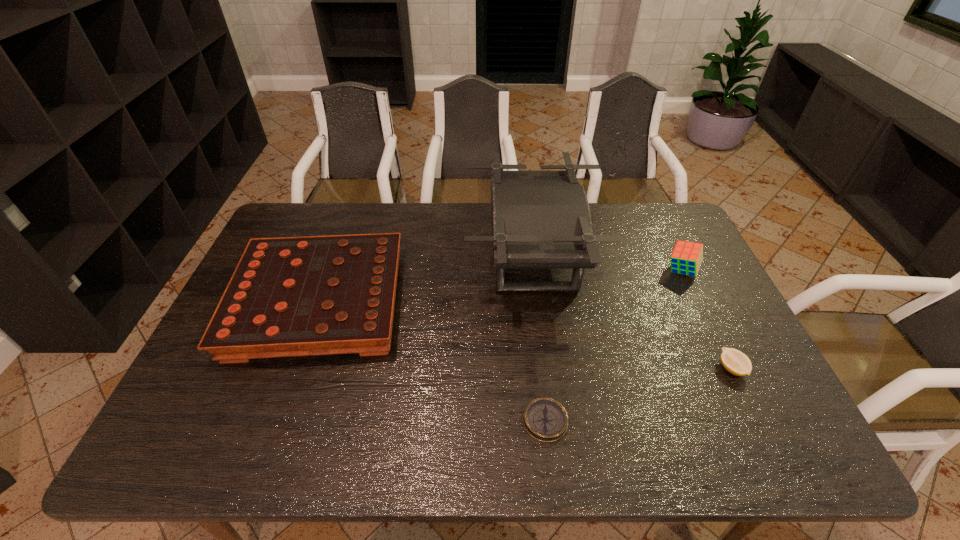
At what (x,y) coordinates should I click in order to perform the action: click on blank space that satisfies the following two spatial constraints: 1. with a camera mounted on the underside of the drone; 2. on the front side of the leftmost object. Please return your answer as a coordinate pair (x, y). Looking at the image, I should click on (539, 303).

I want to click on vacant point that satisfies the following two spatial constraints: 1. with a camera mounted on the underside of the drone; 2. on the front side of the gameboard, so click(x=539, y=303).

Identify the location of free spot that satisfies the following two spatial constraints: 1. with a camera mounted on the underside of the drone; 2. on the back side of the lemon. (546, 369).

Identify the location of vacant space that satisfies the following two spatial constraints: 1. with a camera mounted on the underside of the drone; 2. on the back side of the second shortest object. The height and width of the screenshot is (540, 960). (546, 369).

The image size is (960, 540). What are the coordinates of `free space that satisfies the following two spatial constraints: 1. with a camera mounted on the underside of the drone; 2. on the front side of the leftmost object` in the screenshot? It's located at (539, 303).